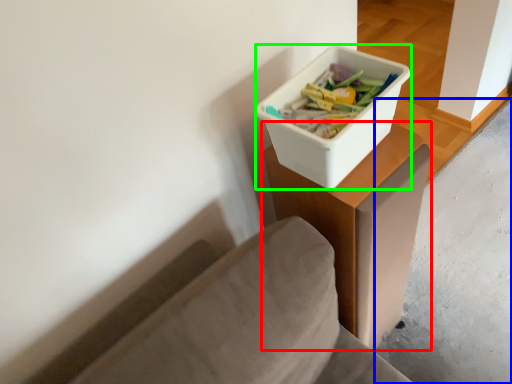
Question: Which is farther away from table (highlighted by a red box)? concrete (highlighted by a blue box) or storage box (highlighted by a green box)?

Choices:
 (A) concrete
 (B) storage box

Answer: (A)